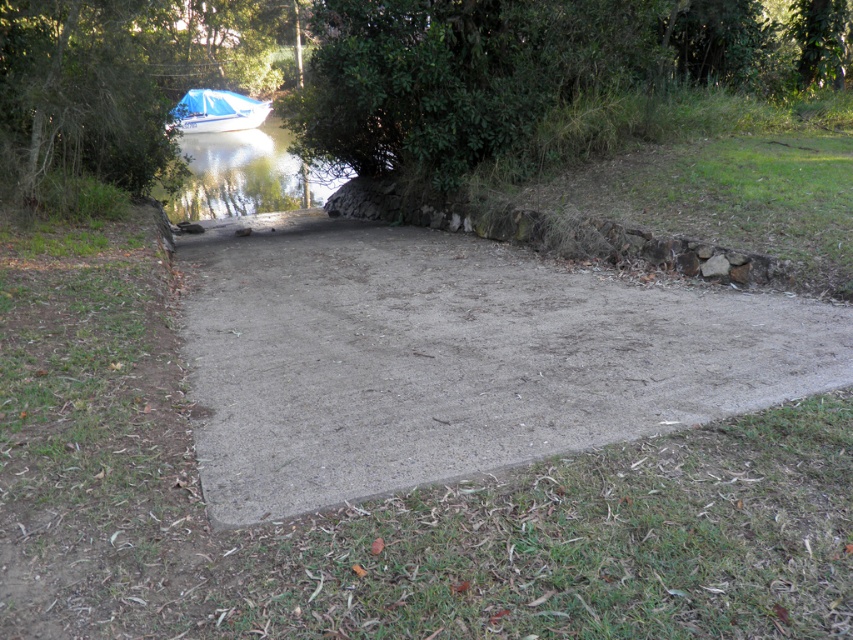
Can you confirm if dull concrete path at center is taller than green leafy tree at upper left?

Incorrect, dull concrete path at center's height is not larger of green leafy tree at upper left's.

Based on the photo, does dull concrete path at center appear on the right side of green leafy tree at upper left?

Indeed, dull concrete path at center is positioned on the right side of green leafy tree at upper left.

The image size is (853, 640). Describe the element at coordinates (454, 358) in the screenshot. I see `dull concrete path at center` at that location.

Where is `dull concrete path at center`? dull concrete path at center is located at coordinates (454, 358).

Does green leafy tree at upper center have a larger size compared to green leafy tree at upper left?

Yes.

Looking at this image, does green leafy tree at upper center come in front of green leafy tree at upper left?

No, it is not.

Identify the location of green leafy tree at upper center. (378, 72).

Image resolution: width=853 pixels, height=640 pixels. Identify the location of green leafy tree at upper center. (378, 72).

Does dull concrete path at center appear under blue glossy water at upper left?

Yes, dull concrete path at center is below blue glossy water at upper left.

Is dull concrete path at center smaller than blue glossy water at upper left?

Indeed, dull concrete path at center has a smaller size compared to blue glossy water at upper left.

Which is in front, point (405, 371) or point (206, 202)?

Point (405, 371)

The height and width of the screenshot is (640, 853). I want to click on dull concrete path at center, so click(x=454, y=358).